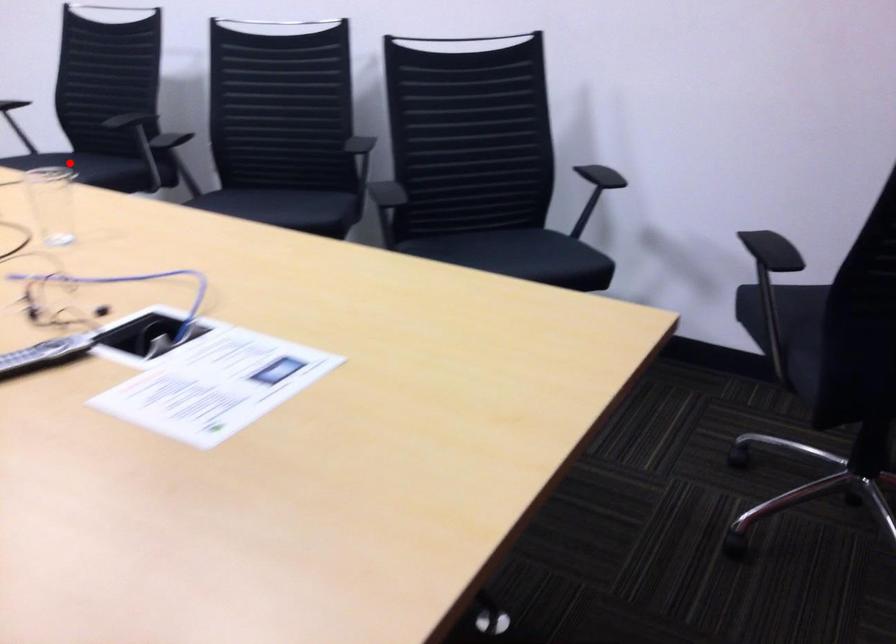
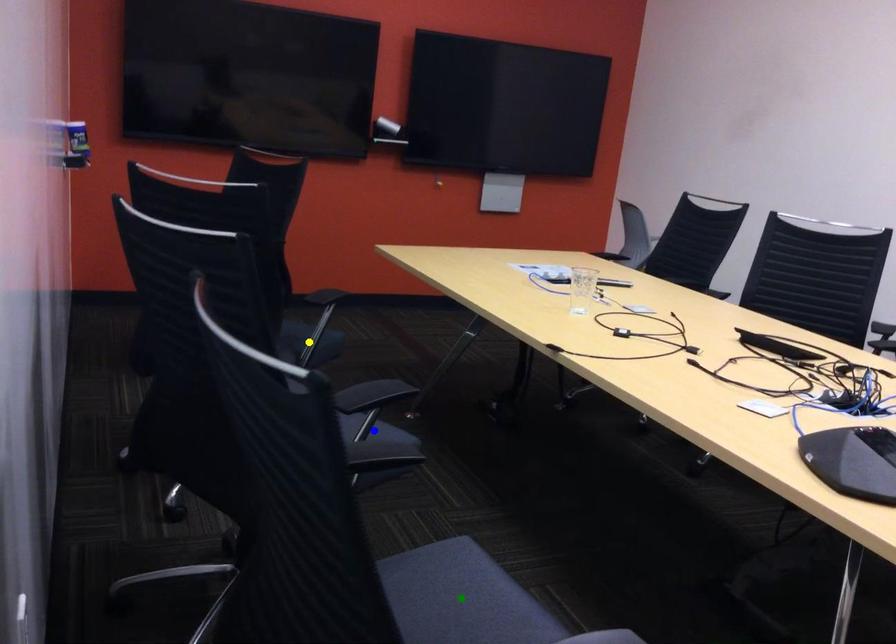
Question: I am providing you with two images of the same scene from different viewpoints. A red point is marked on the first image. You are given multiple points on the second image. In image 2, which mark is for the same physical point as the one in image 1?

Choices:
 (A) yellow point
 (B) green point
 (C) blue point

Answer: (B)